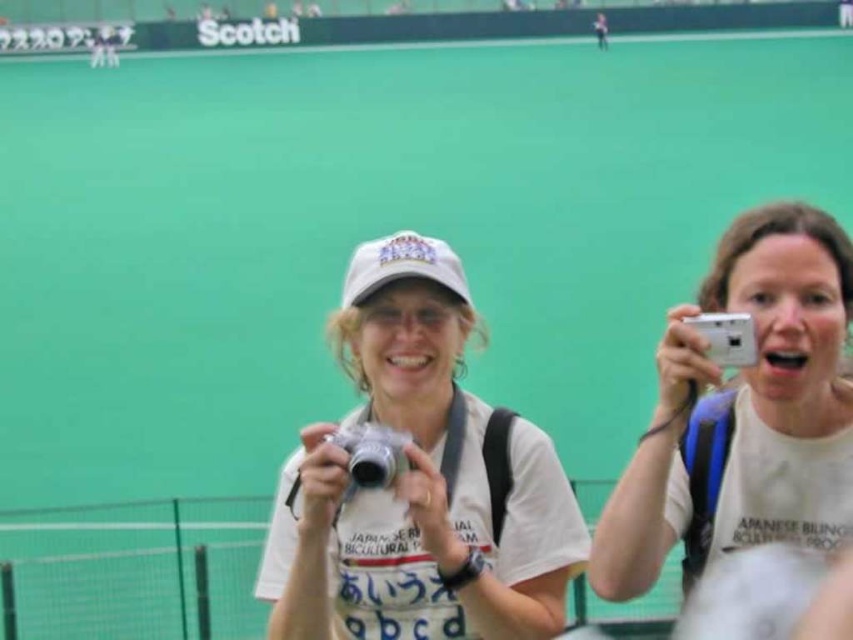
Between white matte cap at center and silver metallic camera at center, which one has less height?

Standing shorter between the two is silver metallic camera at center.

Which is more to the right, white matte cap at center or silver metallic camera at center?

white matte cap at center

Is point (407, 541) positioned after point (368, 433)?

Yes, it is behind point (368, 433).

Find the location of a particular element. The image size is (853, 640). white matte cap at center is located at coordinates (416, 483).

Who is taller, white plastic camera at right or silver metallic camera at center?

Standing taller between the two is white plastic camera at right.

Does white plastic camera at right have a greater height compared to silver metallic camera at center?

Correct, white plastic camera at right is much taller as silver metallic camera at center.

Which is behind, point (834, 480) or point (355, 442)?

The point (355, 442) is behind.

Where is `white plastic camera at right`? Image resolution: width=853 pixels, height=640 pixels. white plastic camera at right is located at coordinates click(x=743, y=412).

Which is behind, point (361, 330) or point (708, 445)?

The point (361, 330) is behind.

Between point (466, 403) and point (784, 442), which one is positioned in front?

Point (784, 442) is in front.

You are a GUI agent. You are given a task and a screenshot of the screen. Output one action in this format:
    pyautogui.click(x=<x>, y=<y>)
    Task: Click on the white matte cap at center
    The image size is (853, 640).
    Given the screenshot: What is the action you would take?
    pyautogui.click(x=416, y=483)